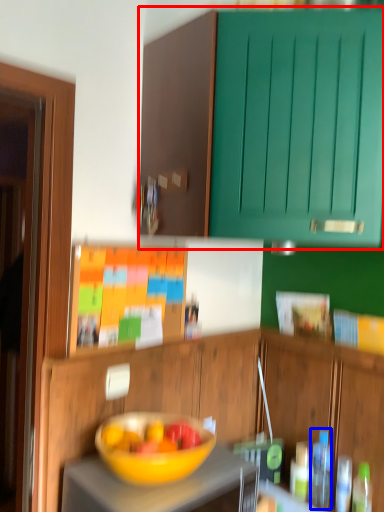
Question: Which object is further to the camera taking this photo, cabinetry (highlighted by a red box) or bottle (highlighted by a blue box)?

Choices:
 (A) cabinetry
 (B) bottle

Answer: (B)